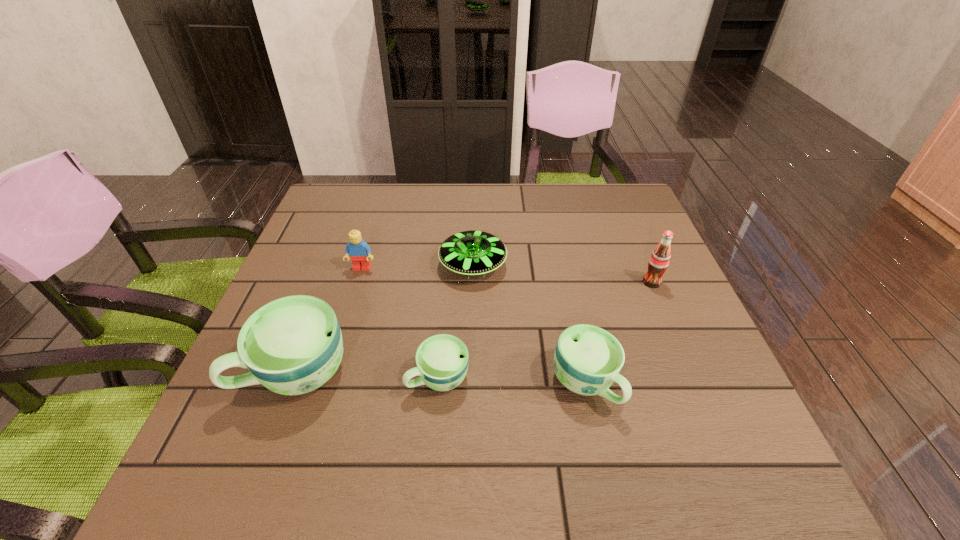
At what (x,y) coordinates should I click in order to perform the action: click on free space located 0.320m on the back of the saucer. Please return your answer as a coordinate pair (x, y). Looking at the image, I should click on (474, 183).

Image resolution: width=960 pixels, height=540 pixels. What are the coordinates of `vacant region located 0.100m on the face of the Lego` in the screenshot? It's located at (352, 301).

You are a GUI agent. You are given a task and a screenshot of the screen. Output one action in this format:
    pyautogui.click(x=<x>, y=<y>)
    Task: Click on the vacant space located on the left of the soda
    This screenshot has height=540, width=960.
    Given the screenshot: What is the action you would take?
    pyautogui.click(x=543, y=282)

The width and height of the screenshot is (960, 540). I want to click on cup that is at the left edge, so click(x=293, y=345).

Locate an element on the screen. This screenshot has height=540, width=960. Lego positioned at the left edge is located at coordinates (359, 251).

Find the location of a particular element. object present at the right edge is located at coordinates (659, 260).

At what (x,y) coordinates should I click in order to perform the action: click on object at the near left corner. Please return your answer as a coordinate pair (x, y). Looking at the image, I should click on (293, 345).

Locate an element on the screen. The height and width of the screenshot is (540, 960). blank space at the far edge of the desktop is located at coordinates (482, 210).

What are the coordinates of `free location at the near edge` in the screenshot? It's located at (388, 399).

This screenshot has height=540, width=960. What are the coordinates of `vacant position at the left edge of the desktop` in the screenshot? It's located at (294, 265).